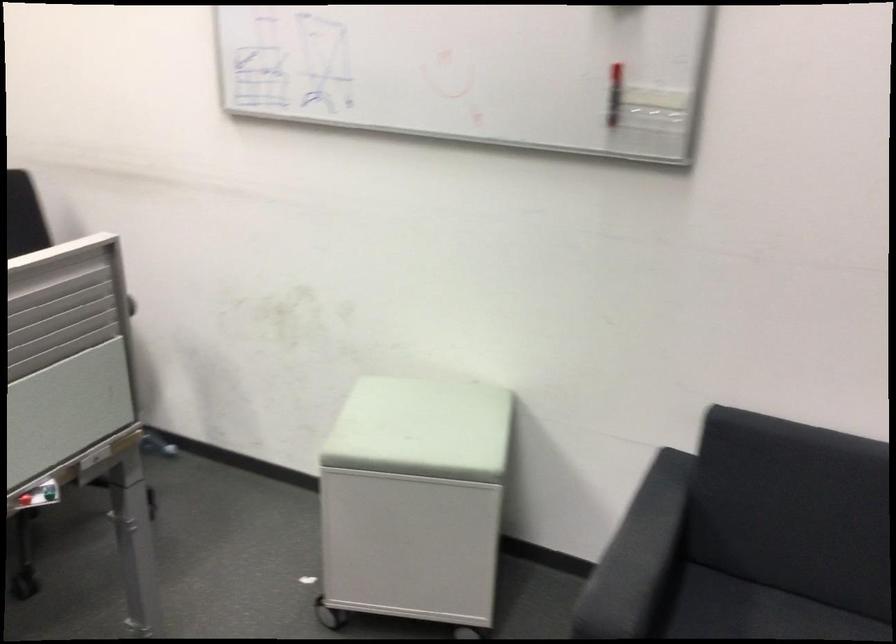
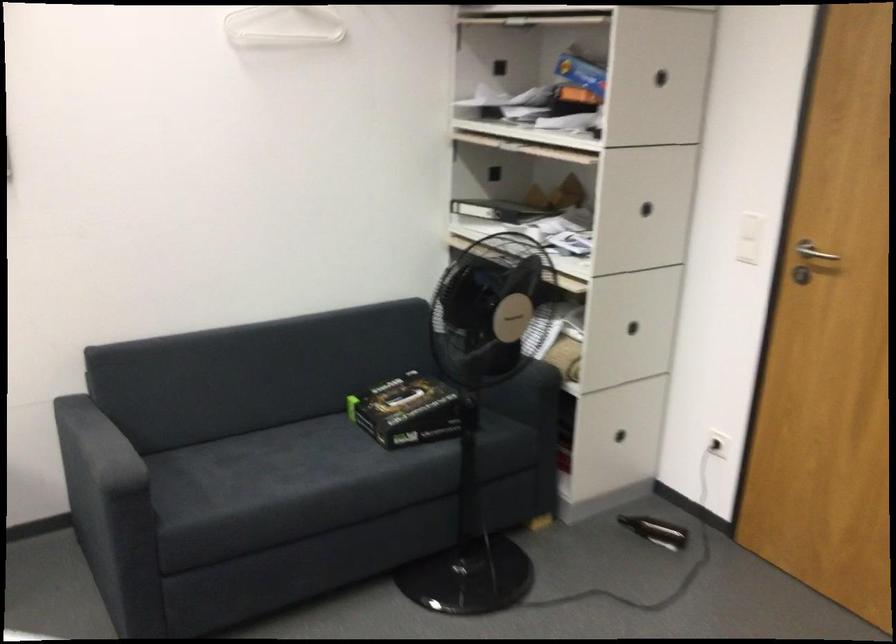
The point at (636, 532) is marked in the first image. Where is the corresponding point in the second image?

(93, 440)